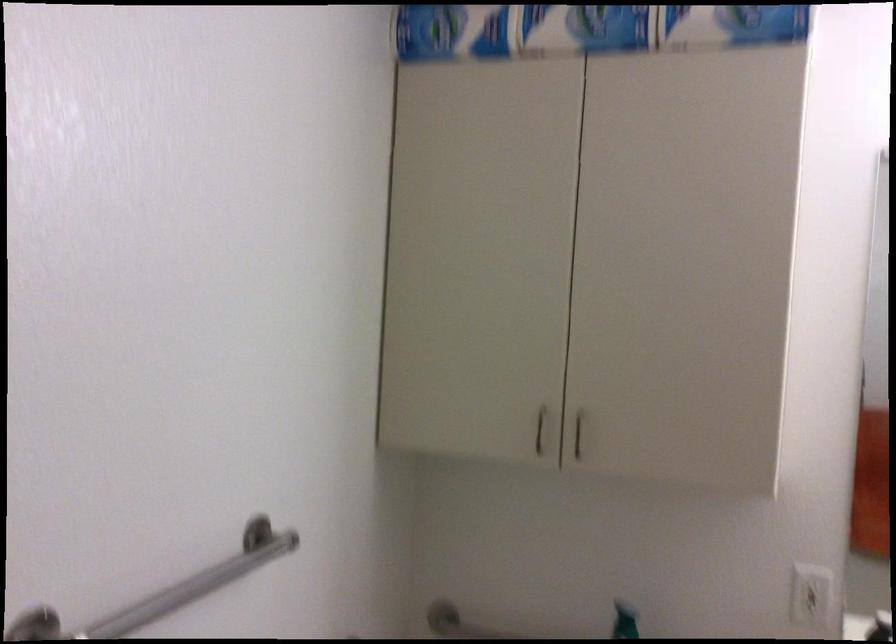
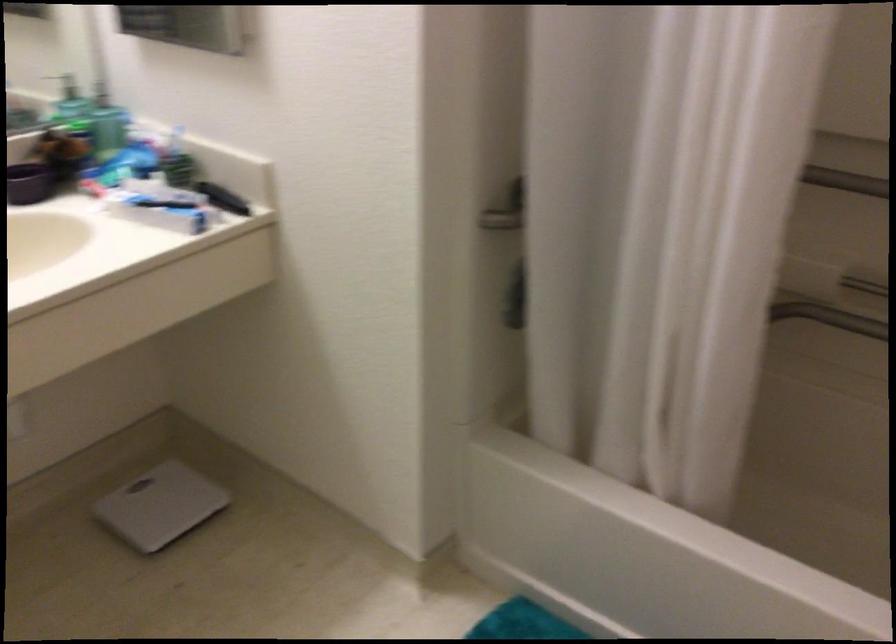
First-person continuous shooting, in which direction is the camera rotating?

The rotation direction of the camera is right-down.